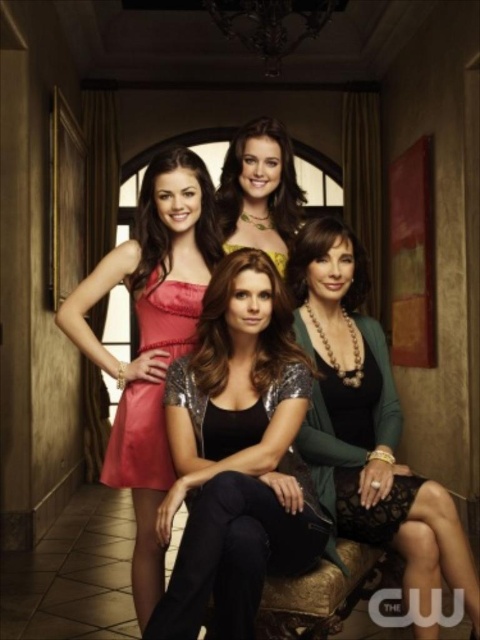
Question: Based on their relative distances, which object is farther from the green textured cardigan at center?

Choices:
 (A) satin dress at center
 (B) lace fabric dress at lower right
 (C) shiny silver sequin top at center

Answer: (A)

Question: Does lace fabric dress at lower right have a greater width compared to matte gold necklace at center?

Choices:
 (A) no
 (B) yes

Answer: (A)

Question: Is lace fabric dress at lower right further to the viewer compared to matte gold necklace at center?

Choices:
 (A) yes
 (B) no

Answer: (B)

Question: Does satin dress at center appear on the left side of matte gold necklace at center?

Choices:
 (A) yes
 (B) no

Answer: (A)

Question: Based on their relative distances, which object is nearer to the matte gold necklace at center?

Choices:
 (A) lace fabric dress at lower right
 (B) shiny silver sequin top at center
 (C) green textured cardigan at center
 (D) satin dress at left

Answer: (D)

Question: Which object is positioned farthest from the matte gold necklace at center?

Choices:
 (A) shiny silver sequin top at center
 (B) green textured cardigan at center

Answer: (A)